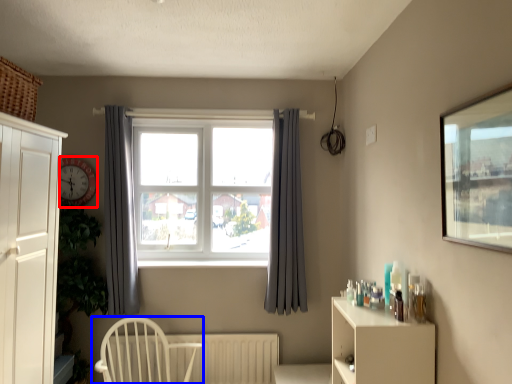
Question: Which object appears closest to the camera in this image, clock (highlighted by a red box) or chair (highlighted by a blue box)?

Choices:
 (A) clock
 (B) chair

Answer: (B)